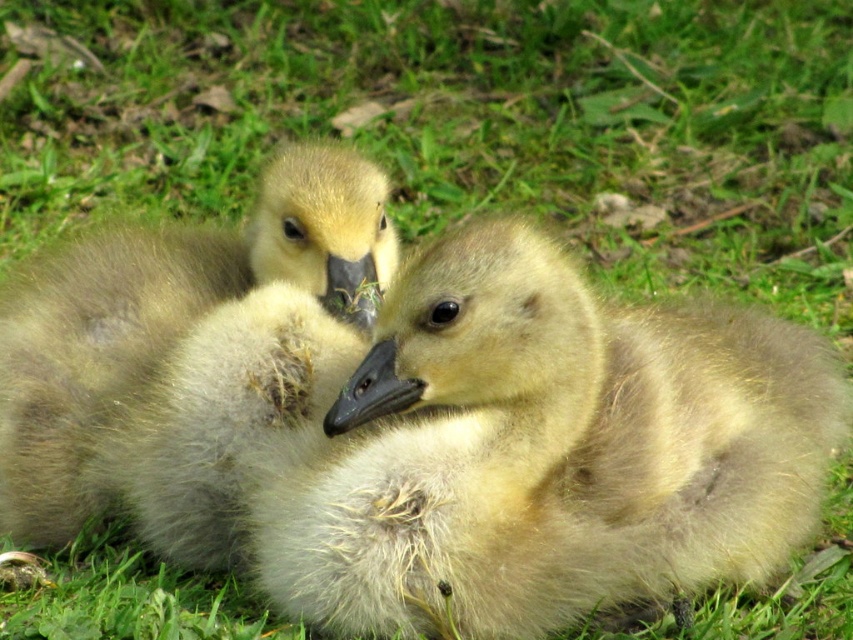
You are a photographer trying to capture the soft brown downy goose at left and the soft yellow down at center in the same frame. Based on their positions, which one is closer to the camera?

The soft yellow down at center is positioned under the soft brown downy goose at left, meaning the soft brown downy goose at left is closer to the camera.

You are a birdwatcher observing two baby geese in a grassy area. You notice the soft yellow down at center and the soft brown downy goose at left. Which of these two has a larger size?

The soft yellow down at center is bigger than the soft brown downy goose at left according to the description provided.